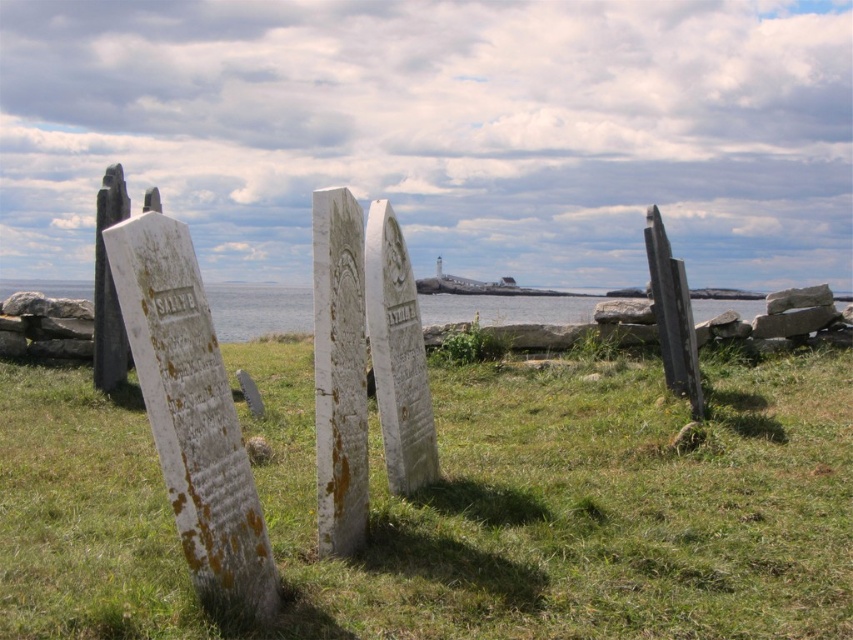
You are a drone operator flying over the coastal cemetery. Your drone is currently above the green grass at center and wants to capture a shot of the clear blue water at center. Can the drone descend straight down to film the water without obstruction?

The green grass at center is positioned under clear blue water at center, so the drone cannot descend straight down to film the water because the grass is below the water in this area.

You are standing at the point closest to the camera in this coastal cemetery scene. Which point are you at, point (25, 540) or point (497, 305)?

You are at point (25, 540) because it is in front of point (497, 305), meaning it is closer to the viewer.